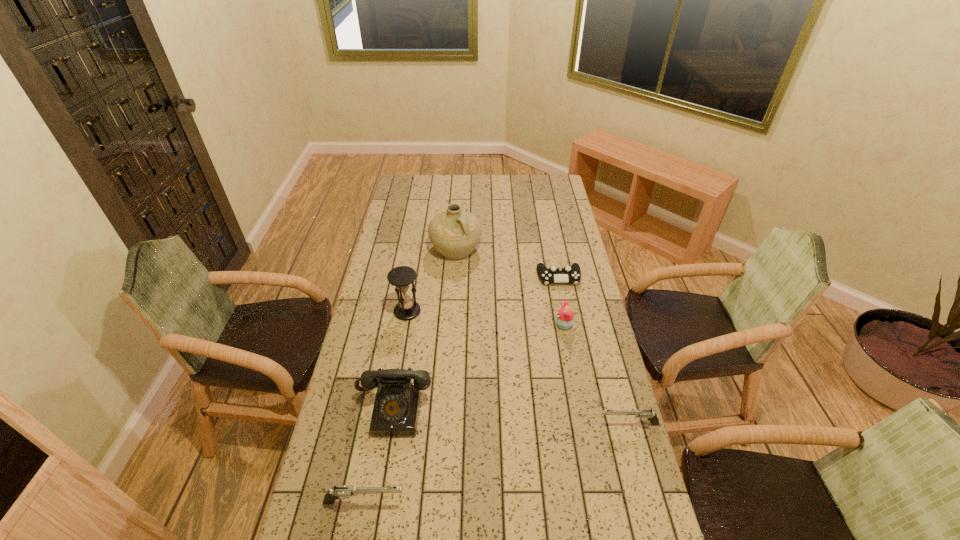
You are a GUI agent. You are given a task and a screenshot of the screen. Output one action in this format:
    pyautogui.click(x=<x>, y=<y>)
    Task: Click on the vacant region located on the dial of the telephone
    The height and width of the screenshot is (540, 960).
    Given the screenshot: What is the action you would take?
    pyautogui.click(x=378, y=503)

You are a GUI agent. You are given a task and a screenshot of the screen. Output one action in this format:
    pyautogui.click(x=<x>, y=<y>)
    Task: Click on the pistol present at the left edge
    The height and width of the screenshot is (540, 960).
    Given the screenshot: What is the action you would take?
    pyautogui.click(x=343, y=491)

Where is `hourglass that is at the left edge`? hourglass that is at the left edge is located at coordinates (401, 277).

Locate an element on the screen. telephone located in the left edge section of the desktop is located at coordinates point(396,408).

Image resolution: width=960 pixels, height=540 pixels. What are the coordinates of `pistol that is at the right edge` in the screenshot? It's located at (644, 415).

You are a GUI agent. You are given a task and a screenshot of the screen. Output one action in this format:
    pyautogui.click(x=<x>, y=<y>)
    Task: Click on the cupcake at the right edge
    This screenshot has height=540, width=960.
    Given the screenshot: What is the action you would take?
    pyautogui.click(x=564, y=319)

This screenshot has height=540, width=960. I want to click on control at the right edge, so click(x=568, y=274).

You are a GUI agent. You are given a task and a screenshot of the screen. Output one action in this format:
    pyautogui.click(x=<x>, y=<y>)
    Task: Click on the vacant area at the far edge
    
    Given the screenshot: What is the action you would take?
    pyautogui.click(x=428, y=188)

What are the coordinates of `vacant area at the near edge of the desktop` in the screenshot? It's located at (509, 539).

In the image, there is a desktop. At what (x,y) coordinates should I click in order to perform the action: click on vacant space at the left edge. Please return your answer as a coordinate pair (x, y). The width and height of the screenshot is (960, 540). Looking at the image, I should click on (397, 236).